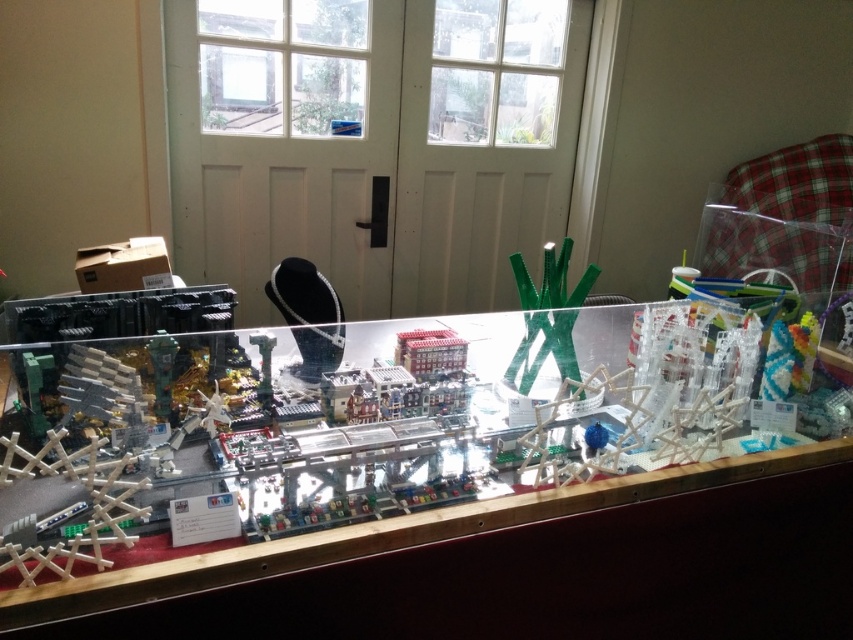
Is point (601, 589) farther from viewer compared to point (308, 308)?

No, (601, 589) is in front of (308, 308).

Is clear plastic table at center thinner than pearl necklace at center?

No.

The height and width of the screenshot is (640, 853). Describe the element at coordinates (418, 522) in the screenshot. I see `clear plastic table at center` at that location.

Image resolution: width=853 pixels, height=640 pixels. Identify the location of clear plastic table at center. (418, 522).

Which is above, clear plastic table at center or green matte plastic x at center?

Positioned higher is green matte plastic x at center.

Can you confirm if clear plastic table at center is positioned to the right of green matte plastic x at center?

Incorrect, clear plastic table at center is not on the right side of green matte plastic x at center.

Does point (810, 444) come behind point (560, 276)?

No, it is not.

At what (x,y) coordinates should I click in order to perform the action: click on clear plastic table at center. Please return your answer as a coordinate pair (x, y). Looking at the image, I should click on (418, 522).

Can you confirm if green matte plastic x at center is shorter than pearl necklace at center?

In fact, green matte plastic x at center may be taller than pearl necklace at center.

Is green matte plastic x at center bigger than pearl necklace at center?

Indeed, green matte plastic x at center has a larger size compared to pearl necklace at center.

Does point (546, 262) come farther from viewer compared to point (294, 301)?

That is True.

Locate an element on the screen. This screenshot has height=640, width=853. green matte plastic x at center is located at coordinates [548, 314].